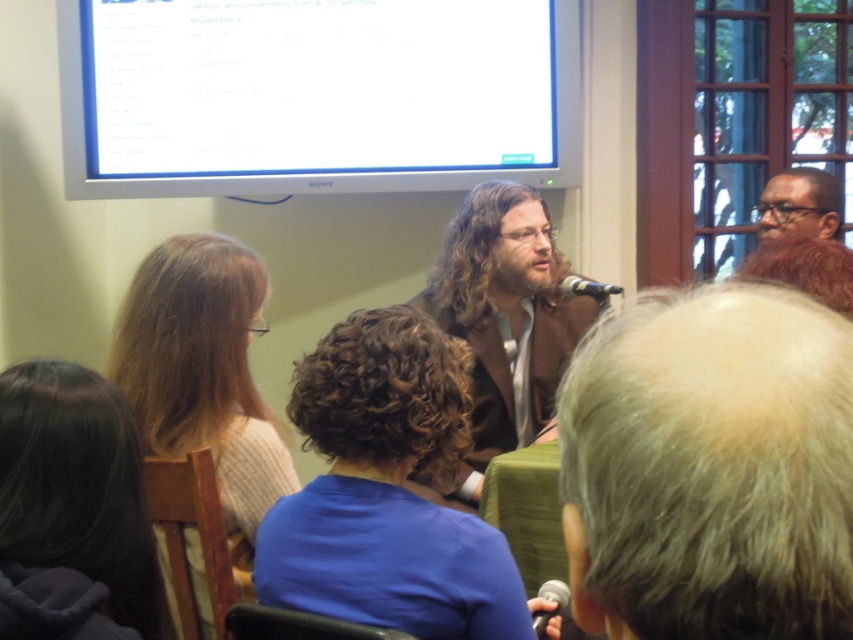
Question: Does white glossy projector screen at upper center have a smaller size compared to matte black beard at upper right?

Choices:
 (A) no
 (B) yes

Answer: (A)

Question: Among these objects, which one is nearest to the camera?

Choices:
 (A) gray hair at center
 (B) matte black beard at upper right
 (C) blue fabric shirt at center

Answer: (A)

Question: Among these objects, which one is farthest from the camera?

Choices:
 (A) brown woolen jacket at center
 (B) light brown sweater at center left
 (C) blue fabric shirt at center

Answer: (A)

Question: Estimate the real-world distances between objects in this image. Which object is closer to the black metallic microphone at lower center?

Choices:
 (A) matte black beard at upper right
 (B) brown woolen jacket at center
 (C) black metallic microphone at center
 (D) gray hair at center

Answer: (C)

Question: Where is white glossy projector screen at upper center located in relation to light brown sweater at center left in the image?

Choices:
 (A) above
 (B) below

Answer: (A)

Question: In this image, where is gray hair at center located relative to matte black beard at upper right?

Choices:
 (A) above
 (B) below

Answer: (B)